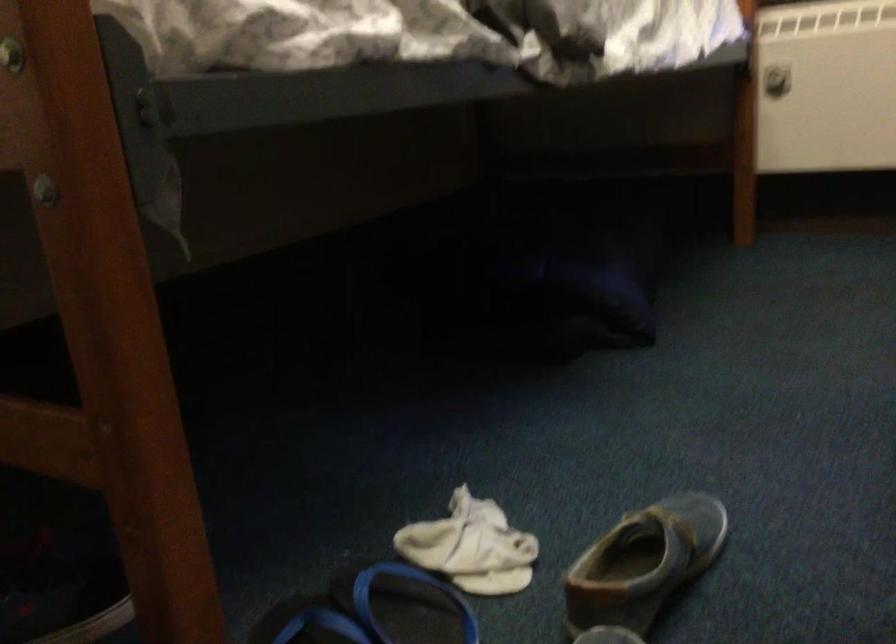
What are the coordinates of `blue flip-flop` in the screenshot? It's located at (406, 605).